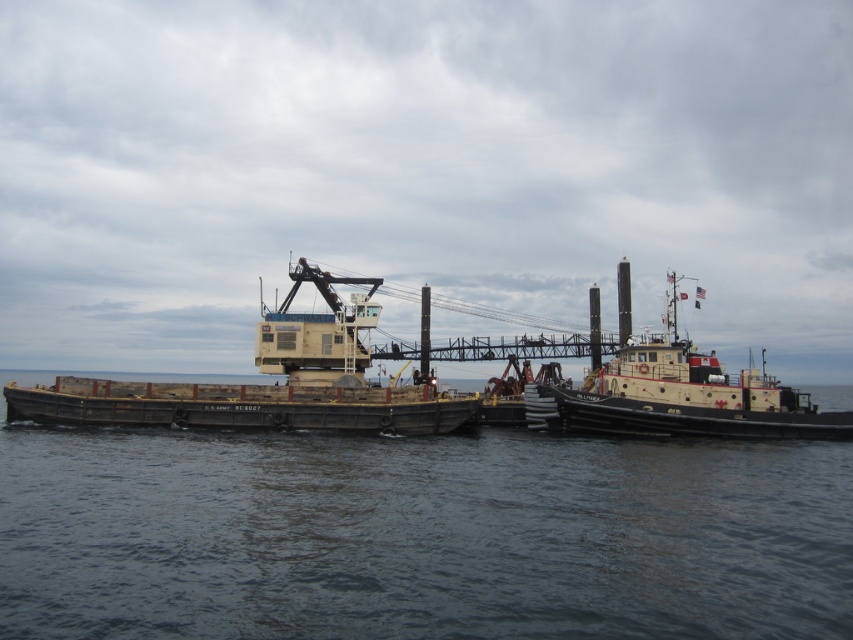
Question: Does dark gray water at center have a smaller size compared to yellow matte tugboat at center?

Choices:
 (A) yes
 (B) no

Answer: (B)

Question: Can you confirm if yellow matte barge at center is wider than dark gray matte barge at center?

Choices:
 (A) no
 (B) yes

Answer: (A)

Question: From the image, what is the correct spatial relationship of dark gray water at center in relation to dark gray matte barge at center?

Choices:
 (A) above
 (B) below

Answer: (B)

Question: Which object is the closest to the yellow matte tugboat at center?

Choices:
 (A) yellow matte barge at center
 (B) dark gray water at center

Answer: (B)

Question: Which of these objects is positioned farthest from the yellow matte barge at center?

Choices:
 (A) dark gray matte barge at center
 (B) dark gray water at center
 (C) yellow matte tugboat at center

Answer: (C)

Question: Which object is the closest to the dark gray matte barge at center?

Choices:
 (A) yellow matte barge at center
 (B) yellow matte tugboat at center

Answer: (A)